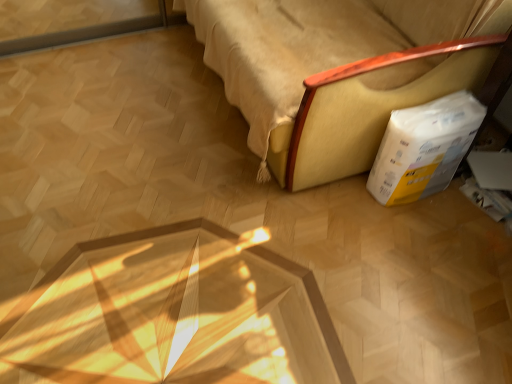
Locate an element on the screen. The height and width of the screenshot is (384, 512). free space to the left of yellow fabric sofa at lower right is located at coordinates (109, 108).